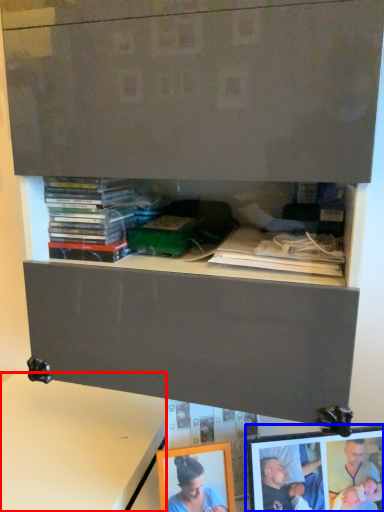
Question: Which object appears closest to the camera in this image, table (highlighted by a red box) or picture frame (highlighted by a blue box)?

Choices:
 (A) table
 (B) picture frame

Answer: (B)